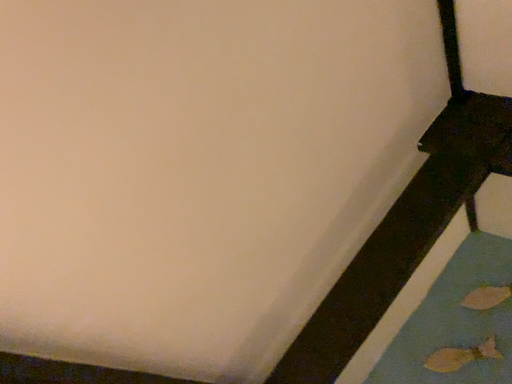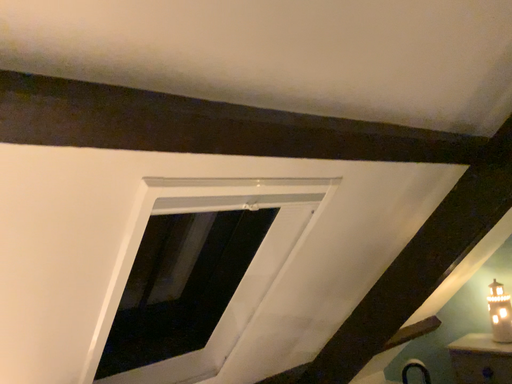
Question: How did the camera likely rotate when shooting the video?

Choices:
 (A) rotated downward
 (B) rotated upward

Answer: (A)